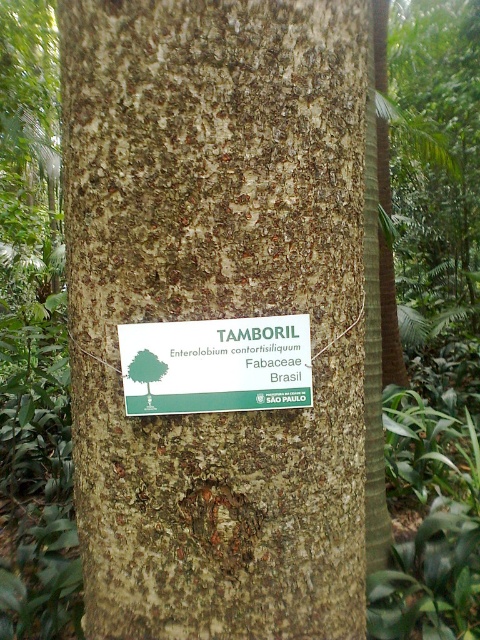
Is brown rough bark at center taller than rough bark tree trunk at center?

No.

Can you confirm if brown rough bark at center is positioned above rough bark tree trunk at center?

Yes, brown rough bark at center is above rough bark tree trunk at center.

Is point (96, 177) positioned behind point (365, 323)?

No, (96, 177) is closer to viewer.

Identify the location of brown rough bark at center. The width and height of the screenshot is (480, 640). (216, 308).

Who is more forward, (x=347, y=532) or (x=289, y=332)?

Point (x=289, y=332) is in front.

Does brown rough bark at center have a lesser width compared to green paper sign at center?

No, brown rough bark at center is not thinner than green paper sign at center.

Does point (181, 19) lie behind point (285, 364)?

No, (181, 19) is closer to viewer.

You are a GUI agent. You are given a task and a screenshot of the screen. Output one action in this format:
    pyautogui.click(x=<x>, y=<y>)
    Task: Click on the brown rough bark at center
    Image resolution: width=480 pixels, height=640 pixels.
    Given the screenshot: What is the action you would take?
    pyautogui.click(x=216, y=308)

Who is more forward, (132, 346) or (380, 380)?

Point (132, 346) is in front.

Who is positioned more to the right, green paper sign at center or rough bark tree trunk at center?

Positioned to the right is rough bark tree trunk at center.

Measure the distance between green paper sign at center and camera.

green paper sign at center is 3.36 feet from camera.

The height and width of the screenshot is (640, 480). I want to click on green paper sign at center, so click(x=216, y=364).